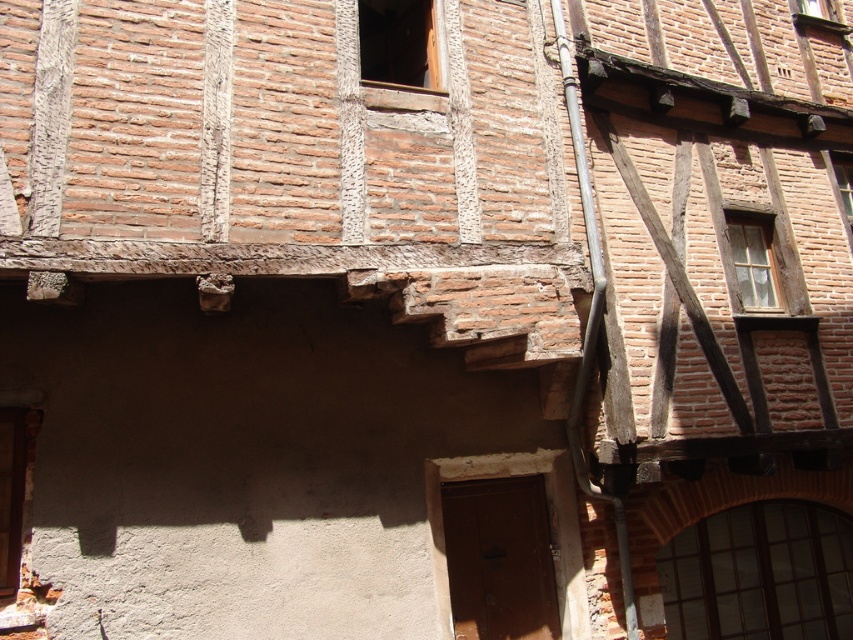
Question: Does dark glass window at lower right appear under wooden frame window at upper right?

Choices:
 (A) no
 (B) yes

Answer: (B)

Question: Which of the following is the farthest from the observer?

Choices:
 (A) wooden frame at upper center
 (B) dark glass window at lower right

Answer: (B)

Question: Which of these objects is positioned farthest from the clear glass window at upper right?

Choices:
 (A) wooden frame at upper center
 (B) wooden frame window at upper right

Answer: (A)

Question: Can you confirm if dark glass window at lower right is wider than wooden frame window at upper right?

Choices:
 (A) no
 (B) yes

Answer: (B)

Question: Based on their relative distances, which object is farther from the clear glass window at upper right?

Choices:
 (A) clear glass window at upper center
 (B) dark glass window at lower right
 (C) wooden frame at upper center
 (D) wooden frame window at upper right

Answer: (C)

Question: Can you confirm if clear glass window at upper right is positioned to the left of clear glass window at upper center?

Choices:
 (A) no
 (B) yes

Answer: (B)